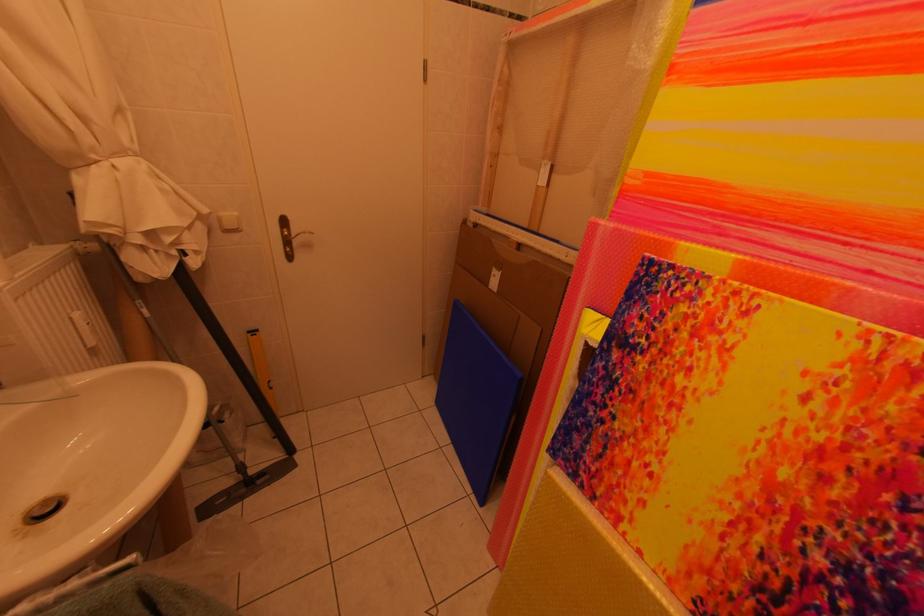
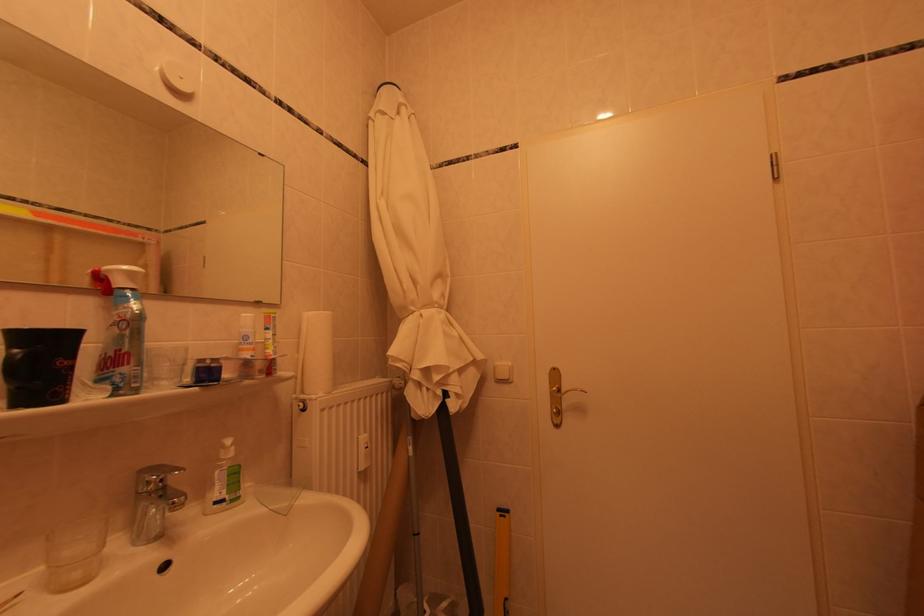
Where in the second image is the point corresponding to (261,339) from the first image?

(509, 519)